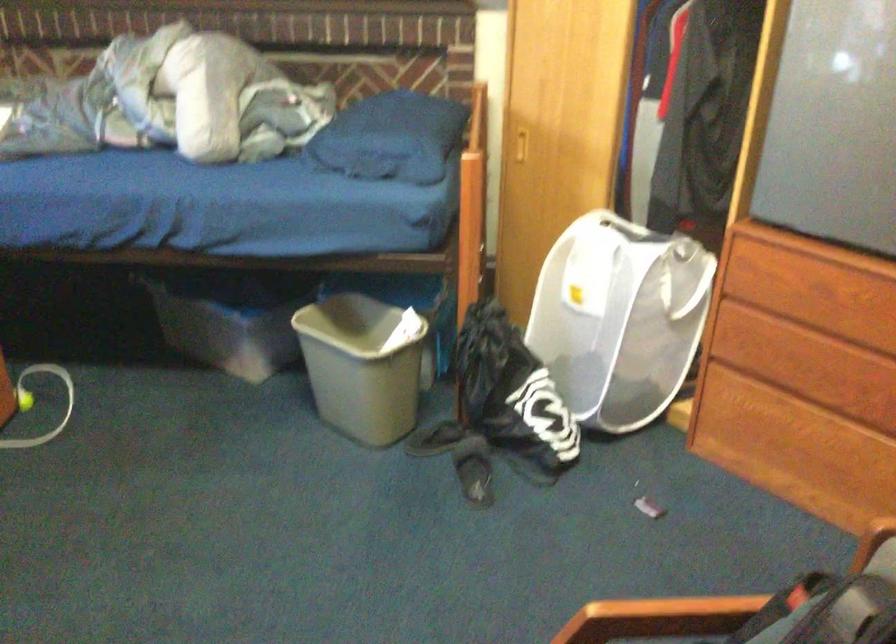
What do you see at coordinates (819, 413) in the screenshot? I see `a wardrobe door handle` at bounding box center [819, 413].